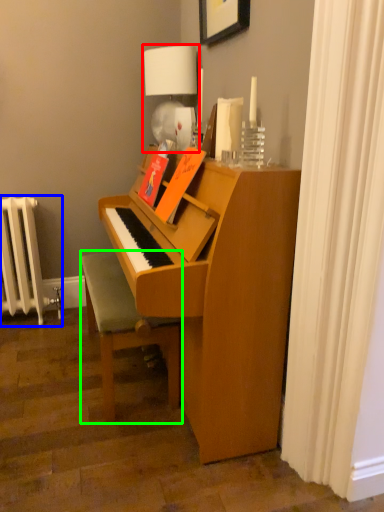
Question: Which is farther away from table lamp (highlighted by a red box)? radiator (highlighted by a blue box) or furniture (highlighted by a green box)?

Choices:
 (A) radiator
 (B) furniture

Answer: (A)